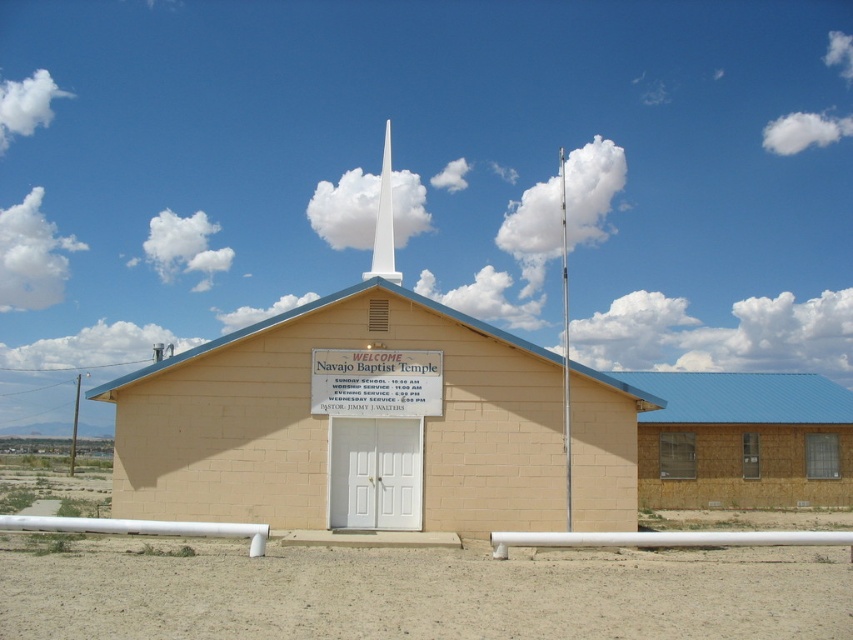
Question: From the image, what is the correct spatial relationship of white wooden sign at center in relation to white smooth spire at center?

Choices:
 (A) left
 (B) right

Answer: (B)

Question: Can you confirm if white wooden sign at center is positioned to the left of white smooth spire at center?

Choices:
 (A) no
 (B) yes

Answer: (A)

Question: Which point is farther from the camera taking this photo?

Choices:
 (A) (316, 371)
 (B) (300, 516)
 (C) (393, 259)

Answer: (C)

Question: Among these points, which one is nearest to the camera?

Choices:
 (A) (534, 470)
 (B) (389, 244)

Answer: (A)

Question: Is beige brick chapel at center above white smooth spire at center?

Choices:
 (A) yes
 (B) no

Answer: (B)

Question: Which object is closer to the camera taking this photo?

Choices:
 (A) beige brick chapel at center
 (B) white wooden sign at center
 (C) white smooth spire at center

Answer: (A)